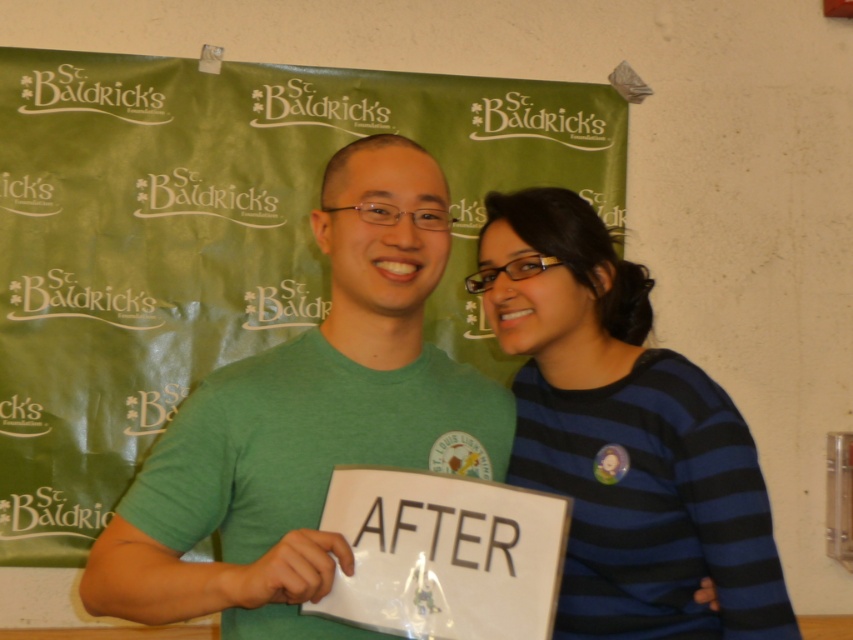
Question: Is green matte t-shirt at center behind blue striped sweater at center?

Choices:
 (A) no
 (B) yes

Answer: (A)

Question: Does green matte t-shirt at center appear on the right side of blue striped sweater at center?

Choices:
 (A) yes
 (B) no

Answer: (B)

Question: Which point is farther to the camera?

Choices:
 (A) (659, 458)
 (B) (407, 378)

Answer: (B)

Question: Can you confirm if green matte t-shirt at center is bigger than blue striped sweater at center?

Choices:
 (A) no
 (B) yes

Answer: (B)